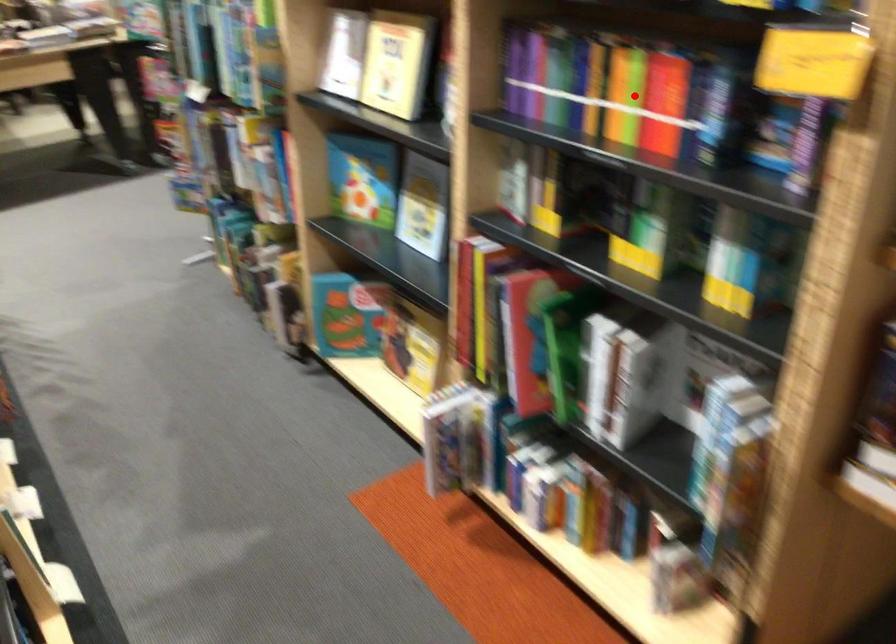
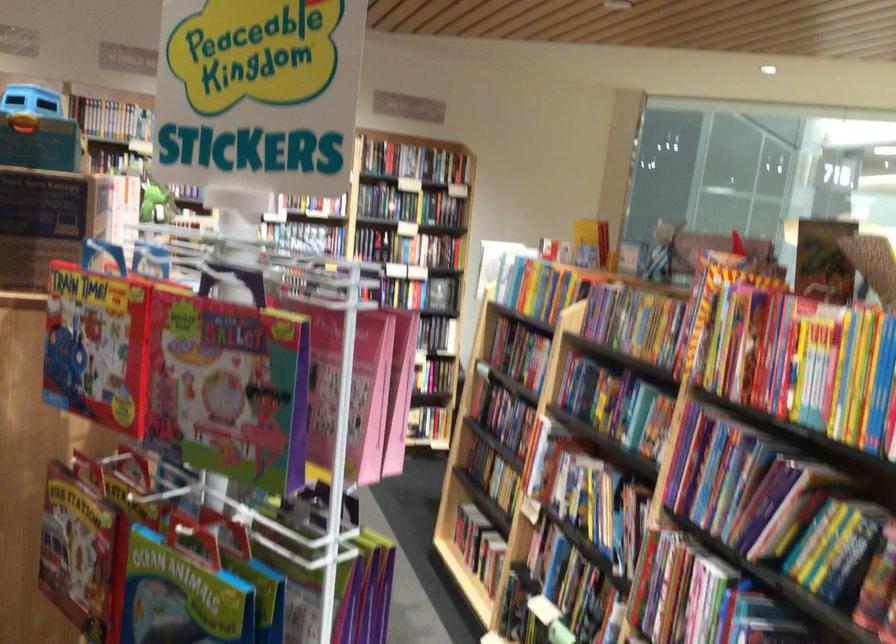
Question: I am providing you with two images of the same scene from different viewpoints. A red point is marked on the first image. At the location where the point appears in image 1, is it still visible in image 2?

Choices:
 (A) Yes
 (B) No

Answer: (B)